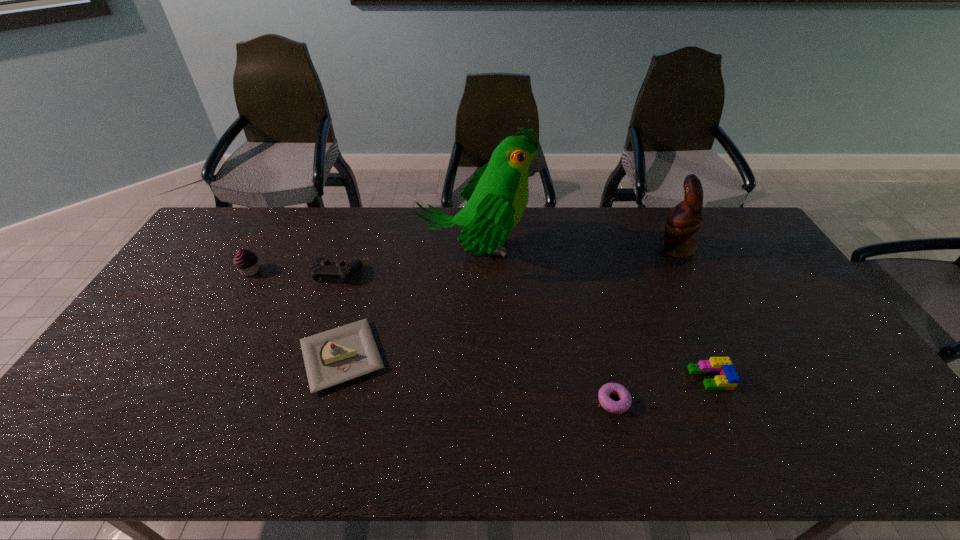
Locate an element on the screen. The image size is (960, 540). parrot situated at the far edge is located at coordinates (685, 219).

You are a GUI agent. You are given a task and a screenshot of the screen. Output one action in this format:
    pyautogui.click(x=<x>, y=<y>)
    Task: Click on the vacant area at the far edge
    
    Given the screenshot: What is the action you would take?
    pyautogui.click(x=524, y=239)

This screenshot has height=540, width=960. What are the coordinates of `vacant space at the near edge of the desktop` in the screenshot? It's located at (185, 428).

Find the location of a particular element. Image resolution: width=960 pixels, height=540 pixels. vacant space at the near left corner of the desktop is located at coordinates 98,457.

What are the coordinates of `vacant space at the far right corner of the desktop` in the screenshot? It's located at (732, 212).

Locate an element on the screen. free spot between the parakeet and the control is located at coordinates (407, 261).

Where is `vacant region between the cake and the parakeet`? vacant region between the cake and the parakeet is located at coordinates (410, 303).

Find the location of `vacant area between the Lego and the leftmost object`. vacant area between the Lego and the leftmost object is located at coordinates (480, 325).

At what (x,y) coordinates should I click in order to perform the action: click on unoccupied area between the second shortest object and the third object from right to left. Please return your answer as a coordinate pair (x, y). This screenshot has height=540, width=960. Looking at the image, I should click on (661, 389).

This screenshot has height=540, width=960. What are the coordinates of `vacant space that's between the third tallest object and the cake` in the screenshot? It's located at (296, 314).